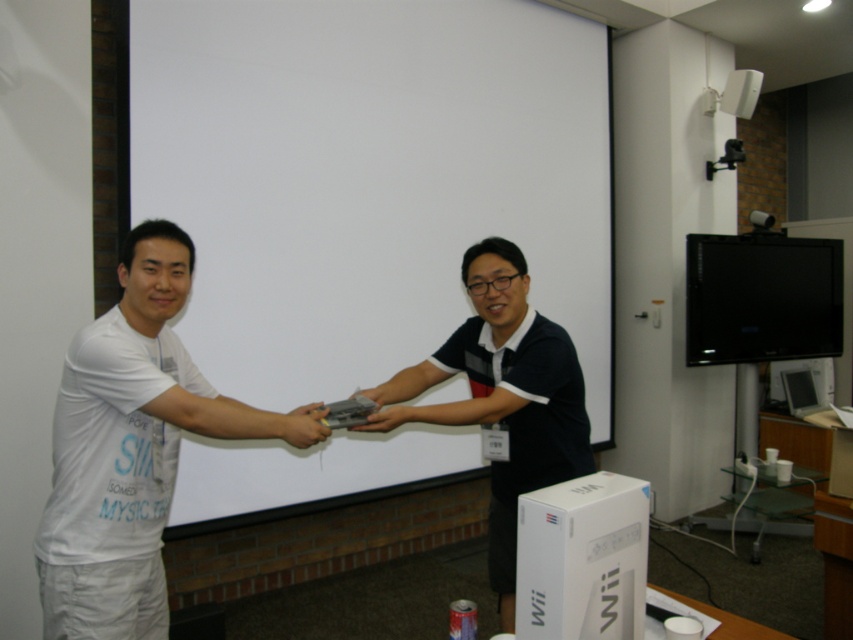
Question: Does white matte projection screen at center appear under dark blue polo shirt at center?

Choices:
 (A) yes
 (B) no

Answer: (B)

Question: Which object is positioned farthest from the dark blue polo shirt at center?

Choices:
 (A) matte gray controller at center
 (B) white matte projection screen at center
 (C) white matte shirt at left

Answer: (B)

Question: Which is nearer to the matte gray controller at center?

Choices:
 (A) black glossy tv at upper right
 (B) dark blue polo shirt at center

Answer: (B)

Question: Which point is farther to the camera?

Choices:
 (A) white matte projection screen at center
 (B) matte gray controller at center
 (C) black glossy tv at upper right

Answer: (C)

Question: Does white matte shirt at left appear on the right side of matte gray controller at center?

Choices:
 (A) yes
 (B) no

Answer: (B)

Question: Is the position of white matte shirt at left less distant than that of black glossy tv at upper right?

Choices:
 (A) no
 (B) yes

Answer: (B)